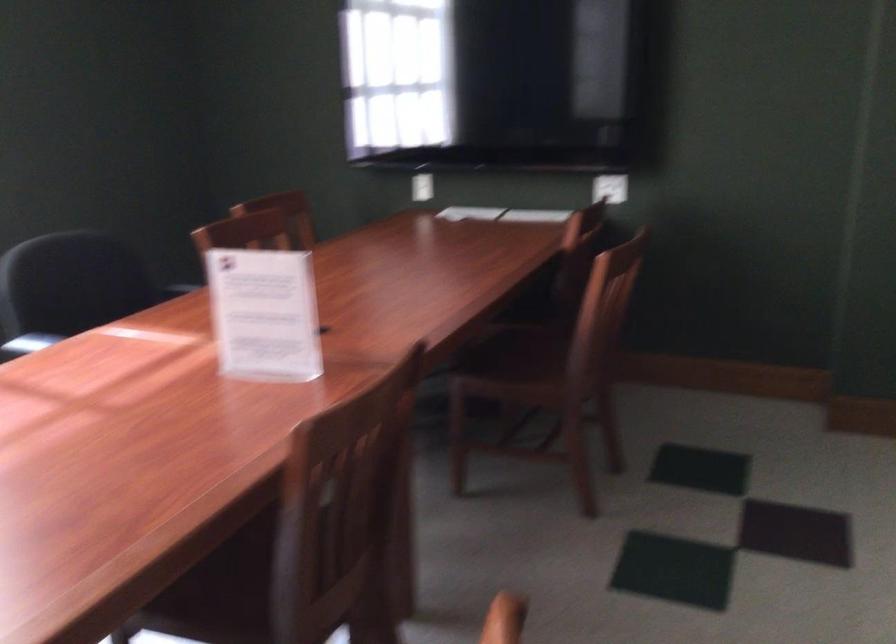
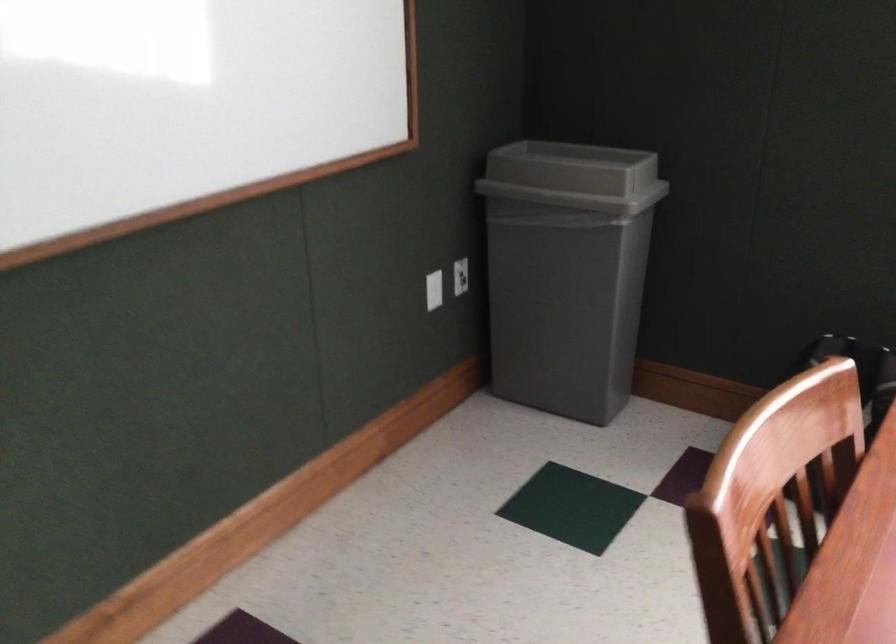
The first image is from the beginning of the video and the second image is from the end. How did the camera likely rotate when shooting the video?

The camera rotated toward left-down.